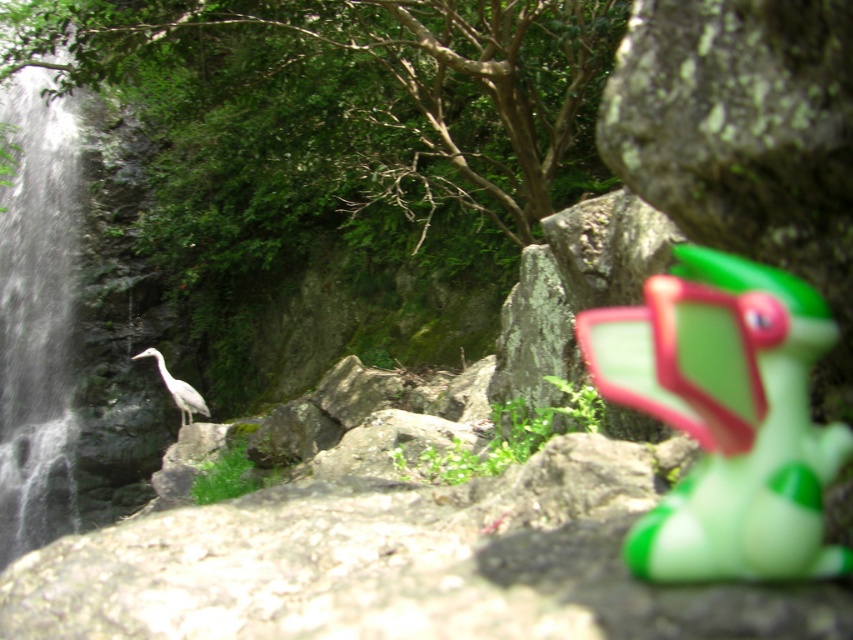
Can you confirm if green rubber toy at right is positioned to the left of gray matte bird at center?

In fact, green rubber toy at right is to the right of gray matte bird at center.

Is point (788, 572) more distant than point (161, 362)?

That is False.

This screenshot has width=853, height=640. Describe the element at coordinates (726, 417) in the screenshot. I see `green rubber toy at right` at that location.

Where is `green rubber toy at right`? green rubber toy at right is located at coordinates (726, 417).